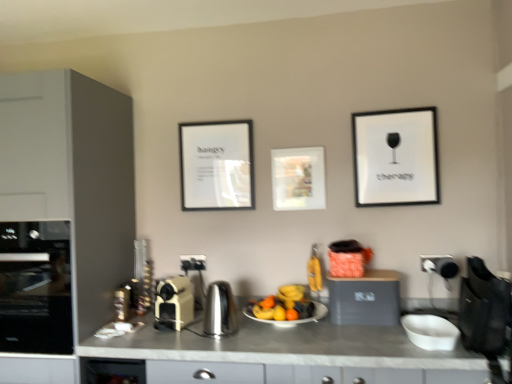
The height and width of the screenshot is (384, 512). Identify the location of empty space that is in between white glossy plate at center and matte gray toaster at center, placed as the first cabinetry when sorted from right to left. (351, 328).